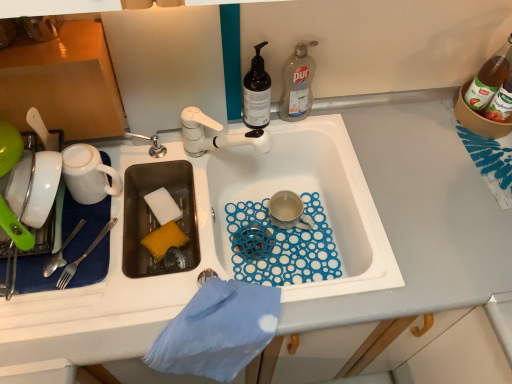
I want to click on free space on the front side of shiny silver fork at left, so click(x=61, y=317).